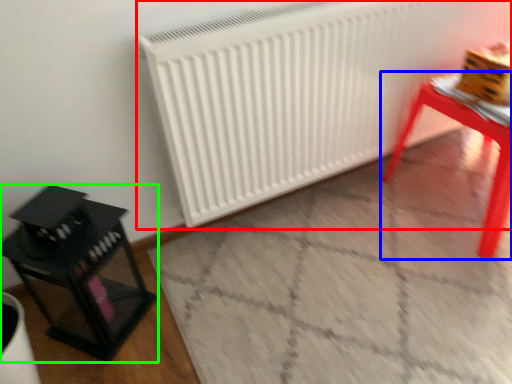
Question: Which object is positioned closest to radiator (highlighted by a red box)? Select from table (highlighted by a blue box) and furniture (highlighted by a green box).

Choices:
 (A) table
 (B) furniture

Answer: (A)